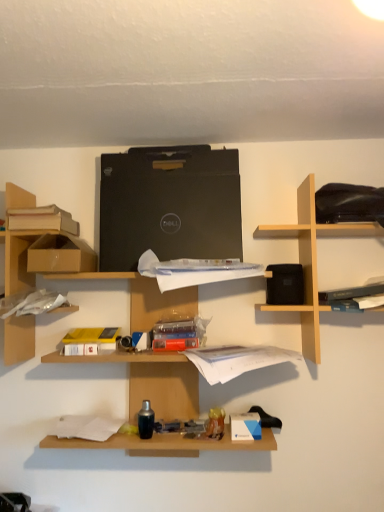
Question: Does white paper at center, the second book positioned from the right, appear on the right side of brown cardboard box at left?

Choices:
 (A) yes
 (B) no

Answer: (A)

Question: Can you confirm if white paper at center, positioned as the 1th book in bottom-to-top order, is wider than brown cardboard box at left?

Choices:
 (A) yes
 (B) no

Answer: (B)

Question: Considering the relative sizes of white paper at center, the second book positioned from the right, and brown cardboard box at left in the image provided, is white paper at center, the second book positioned from the right, taller than brown cardboard box at left?

Choices:
 (A) yes
 (B) no

Answer: (B)

Question: From a real-world perspective, is white paper at center, positioned as the 1th book in bottom-to-top order, on top of brown cardboard box at left?

Choices:
 (A) no
 (B) yes

Answer: (A)

Question: Would you say white paper at center, the 3th book in the top-to-bottom sequence, is outside brown cardboard box at left?

Choices:
 (A) yes
 (B) no

Answer: (A)

Question: In the image, is light wood/black speaker at upper right, the first shelf viewed from the right, on the left side or the right side of brown cardboard boxes at left, the 1th shelf positioned from the left?

Choices:
 (A) left
 (B) right

Answer: (B)

Question: From the image's perspective, relative to brown cardboard boxes at left, the 1th shelf positioned from the left, is light wood/black speaker at upper right, the second shelf viewed from the left, above or below?

Choices:
 (A) above
 (B) below

Answer: (A)

Question: Considering the positions of light wood/black speaker at upper right, the second shelf viewed from the left, and brown cardboard boxes at left, the 1th shelf positioned from the left, in the image, is light wood/black speaker at upper right, the second shelf viewed from the left, taller or shorter than brown cardboard boxes at left, the 1th shelf positioned from the left,?

Choices:
 (A) tall
 (B) short

Answer: (B)

Question: Is light wood/black speaker at upper right, the second shelf viewed from the left, inside the boundaries of brown cardboard boxes at left, the second shelf when ordered from right to left, or outside?

Choices:
 (A) outside
 (B) inside

Answer: (A)

Question: Is matte cardboard book at upper left, marked as the third book in a bottom-to-top arrangement, wider or thinner than light wood/black speaker at upper right, the second shelf viewed from the left?

Choices:
 (A) wide
 (B) thin

Answer: (B)

Question: Would you say matte cardboard book at upper left, the 3th book positioned from the right, is to the left or to the right of light wood/black speaker at upper right, the first shelf viewed from the right, in the picture?

Choices:
 (A) left
 (B) right

Answer: (A)

Question: From a real-world perspective, relative to light wood/black speaker at upper right, the first shelf viewed from the right, is matte cardboard book at upper left, marked as the third book in a bottom-to-top arrangement, vertically above or below?

Choices:
 (A) below
 (B) above

Answer: (B)

Question: From the image's perspective, is matte cardboard book at upper left, marked as the third book in a bottom-to-top arrangement, positioned above or below light wood/black speaker at upper right, the second shelf viewed from the left?

Choices:
 (A) above
 (B) below

Answer: (A)

Question: Is hardcover book at upper right, which is counted as the 1th book, starting from the right, bigger or smaller than white paper at center, the second book positioned from the right?

Choices:
 (A) big
 (B) small

Answer: (B)

Question: From their relative heights in the image, would you say hardcover book at upper right, acting as the 3th book starting from the left, is taller or shorter than white paper at center, the 3th book in the top-to-bottom sequence?

Choices:
 (A) tall
 (B) short

Answer: (A)